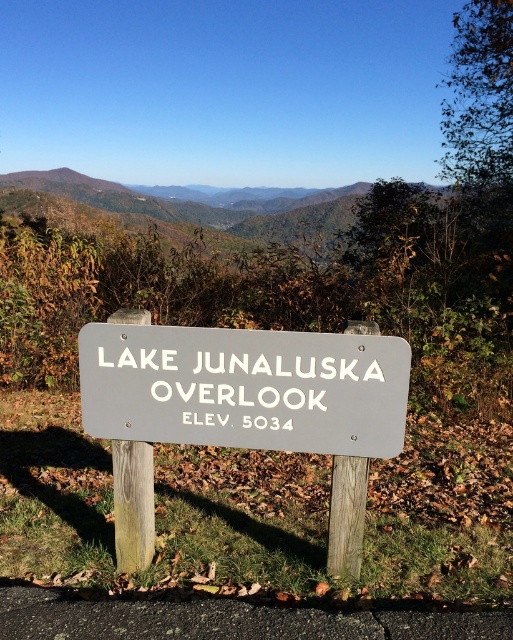
Question: Does gray wood sign at center appear on the left side of green leafy mountain at upper center?

Choices:
 (A) yes
 (B) no

Answer: (A)

Question: Which of the following is the farthest from the observer?

Choices:
 (A) (336, 557)
 (B) (248, 193)

Answer: (B)

Question: Can you confirm if gray wood sign at center is positioned below green leafy mountain at upper center?

Choices:
 (A) yes
 (B) no

Answer: (A)

Question: Among these points, which one is farthest from the camera?

Choices:
 (A) (360, 506)
 (B) (331, 230)

Answer: (B)

Question: Is gray wood sign at center to the left of green leafy mountain at upper center from the viewer's perspective?

Choices:
 (A) no
 (B) yes

Answer: (B)